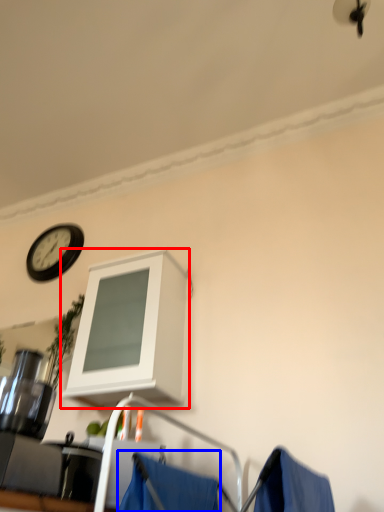
Question: Which object is closer to the camera taking this photo, cabinetry (highlighted by a red box) or curtain (highlighted by a blue box)?

Choices:
 (A) cabinetry
 (B) curtain

Answer: (B)